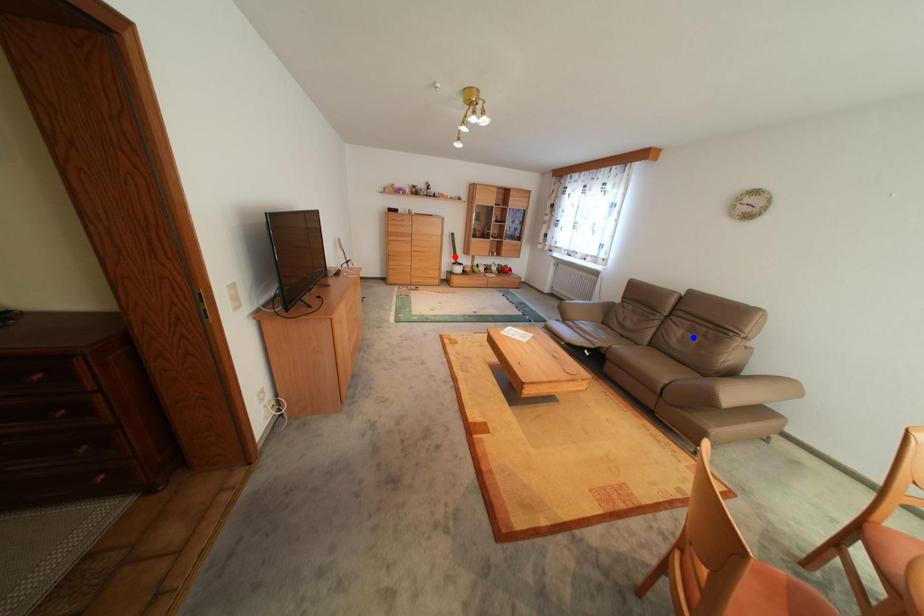
Question: Two points are marked on the image. Which point is closer to the camera?

Choices:
 (A) Blue point is closer.
 (B) Red point is closer.

Answer: (A)